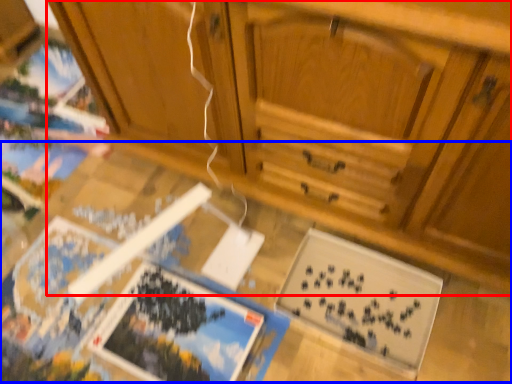
Question: Which object is closer to the camera taking this photo, cabinetry (highlighted by a red box) or table (highlighted by a blue box)?

Choices:
 (A) cabinetry
 (B) table

Answer: (A)